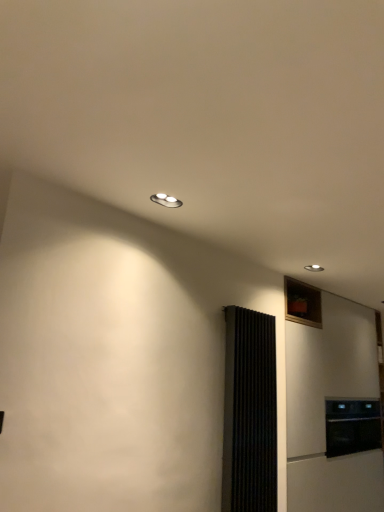
Question: In the image, is black matte oven at lower right positioned in front of or behind black ribbed screen door at right?

Choices:
 (A) behind
 (B) front

Answer: (A)

Question: Does point (355, 424) appear closer or farther from the camera than point (274, 336)?

Choices:
 (A) closer
 (B) farther

Answer: (B)

Question: Which object is positioned closest to the black matte oven at lower right?

Choices:
 (A) black ribbed screen door at right
 (B) white matte refrigerator at right

Answer: (B)

Question: Estimate the real-world distances between objects in this image. Which object is closer to the white matte refrigerator at right?

Choices:
 (A) black matte oven at lower right
 (B) black ribbed screen door at right

Answer: (A)